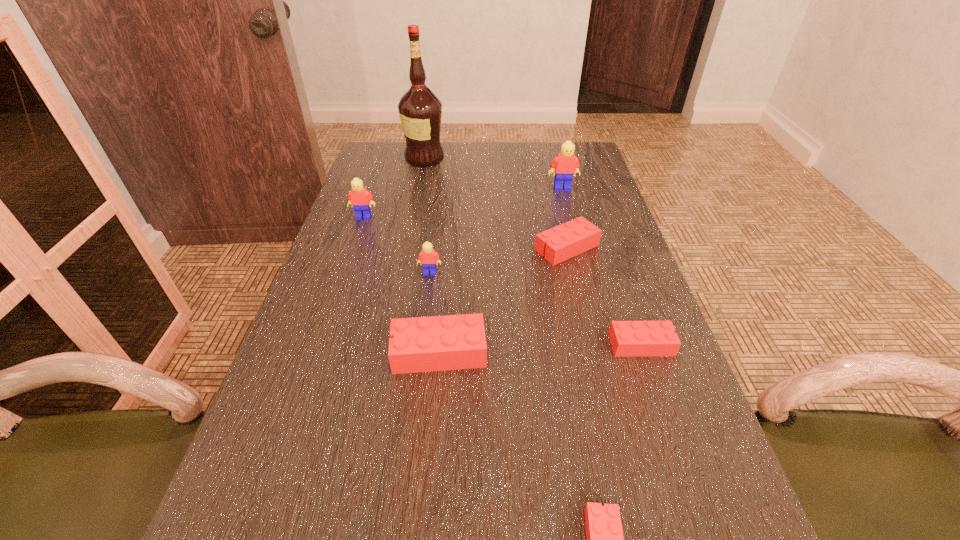
Locate an element on the screen. The image size is (960, 540). the farthest red Lego is located at coordinates (574, 237).

Identify the location of the second biggest red Lego. The height and width of the screenshot is (540, 960). (574, 237).

This screenshot has width=960, height=540. I want to click on the third biggest red Lego, so click(x=628, y=338).

The height and width of the screenshot is (540, 960). I want to click on the sixth tallest Lego, so click(x=628, y=338).

Find the location of a particular element. vacant space situated 0.200m on the label of the tallest object is located at coordinates (504, 158).

Locate an element on the screen. Image resolution: width=960 pixels, height=540 pixels. vacant space located 0.290m on the front-facing side of the rightmost yellow Lego is located at coordinates click(579, 252).

This screenshot has width=960, height=540. I want to click on free location located on the front-facing side of the third farthest object, so click(x=326, y=327).

Locate an element on the screen. Image resolution: width=960 pixels, height=540 pixels. free space located 0.150m on the front-facing side of the fourth farthest Lego is located at coordinates (423, 323).

Find the location of a particular element. free space located on the left of the biggest red Lego is located at coordinates (286, 352).

Where is `free region located on the front of the second biggest red Lego`? The height and width of the screenshot is (540, 960). free region located on the front of the second biggest red Lego is located at coordinates (576, 286).